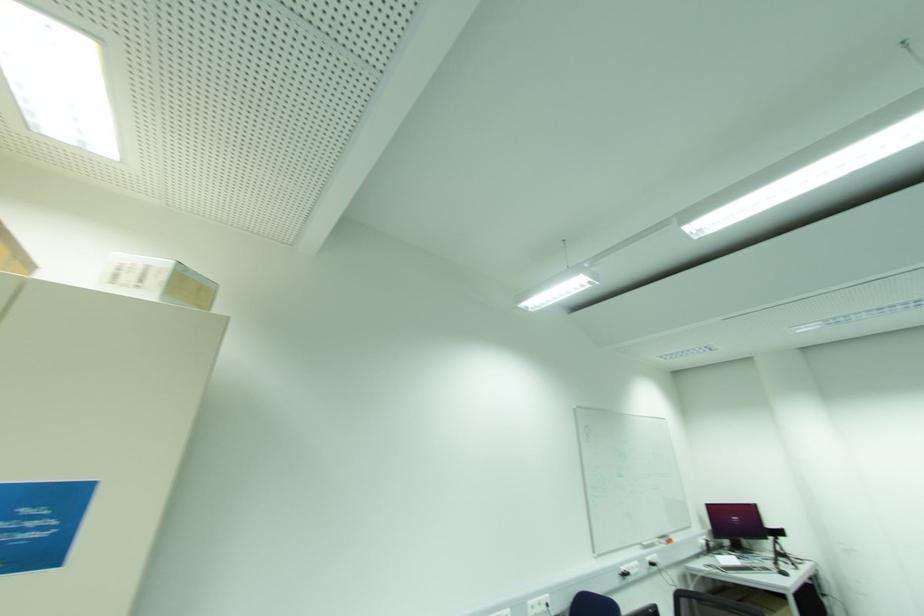
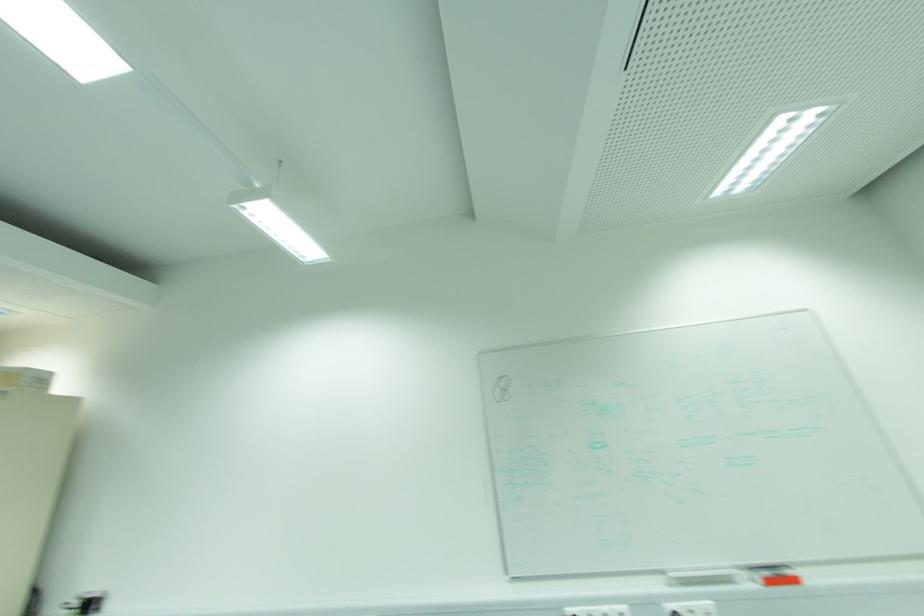
Locate, in the second image, the point that corresponds to (672,541) in the first image.

(796, 581)